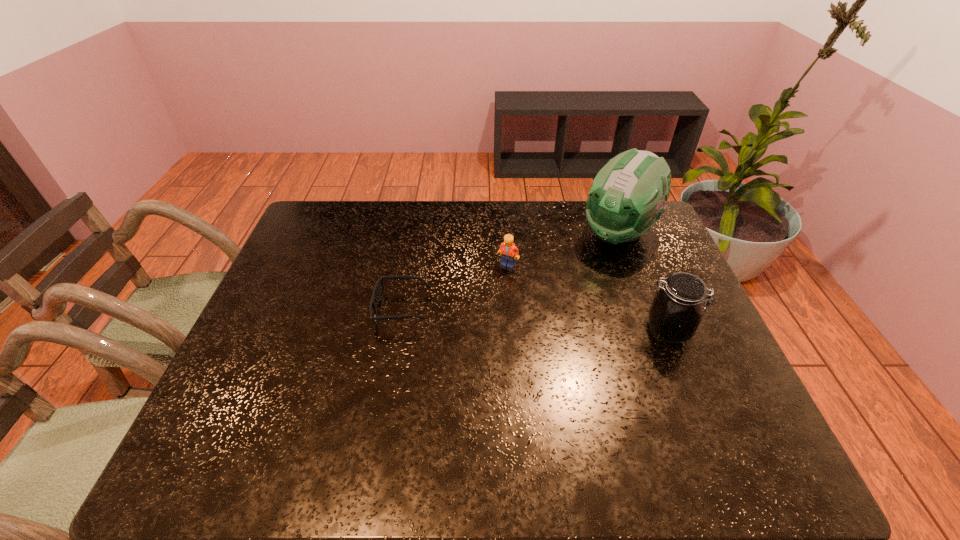
This screenshot has height=540, width=960. Find the location of `vacant area between the jar and the second shortest object`. vacant area between the jar and the second shortest object is located at coordinates (588, 298).

The image size is (960, 540). What are the coordinates of `free space between the shortest object and the third shortest object` in the screenshot? It's located at (535, 320).

Locate an element on the screen. vacant point located between the jar and the second object from left to right is located at coordinates (588, 298).

Find the location of a particular element. The image size is (960, 540). object identified as the closest to the football helmet is located at coordinates (509, 252).

Select which object is the second closest to the football helmet. Please provide its 2D coordinates. Your answer should be formatted as a tuple, i.e. [(x, y)], where the tuple contains the x and y coordinates of a point satisfying the conditions above.

[(675, 313)]

This screenshot has height=540, width=960. In order to click on free spot that satisfies the following two spatial constraints: 1. on the front side of the second tallest object; 2. on the lid of the tallest object in this screenshot , I will do `click(656, 331)`.

You are a GUI agent. You are given a task and a screenshot of the screen. Output one action in this format:
    pyautogui.click(x=<x>, y=<y>)
    Task: Click on the free location that satisfies the following two spatial constraints: 1. on the front side of the jar; 2. on the lid of the tallest object
    The height and width of the screenshot is (540, 960).
    Given the screenshot: What is the action you would take?
    pyautogui.click(x=656, y=331)